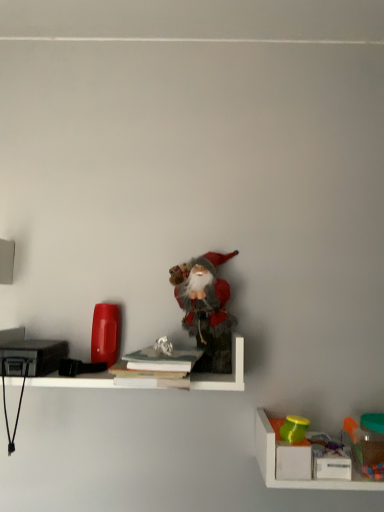
Question: Is matte green cup at lower right, placed as the second toy when sorted from right to left, oriented away from hardcover book at center, which ranks as the second book in top-to-bottom order?

Choices:
 (A) no
 (B) yes

Answer: (A)

Question: Does matte green cup at lower right, placed as the 2th toy when sorted from bottom to top, have a larger size compared to hardcover book at center, which ranks as the second book in top-to-bottom order?

Choices:
 (A) no
 (B) yes

Answer: (A)

Question: Is matte green cup at lower right, which is the 2th toy in left-to-right order, in front of hardcover book at center, which ranks as the second book in top-to-bottom order?

Choices:
 (A) no
 (B) yes

Answer: (A)

Question: From a real-world perspective, is matte green cup at lower right, placed as the 2th toy when sorted from bottom to top, positioned over hardcover book at center, which ranks as the second book in top-to-bottom order, based on gravity?

Choices:
 (A) no
 (B) yes

Answer: (A)

Question: Is matte green cup at lower right, positioned as the 2th toy in top-to-bottom order, at the left side of hardcover book at center, which ranks as the second book in top-to-bottom order?

Choices:
 (A) yes
 (B) no

Answer: (B)

Question: Is white paper at center, the 1th book positioned from the top, spatially inside translucent plastic container at lower right, the second shelf viewed from the top, or outside of it?

Choices:
 (A) outside
 (B) inside

Answer: (A)

Question: Visually, is white paper at center, the 1th book positioned from the top, positioned to the left or to the right of translucent plastic container at lower right, the 1th shelf when ordered from bottom to top?

Choices:
 (A) left
 (B) right

Answer: (A)

Question: Is white paper at center, which ranks as the second book in bottom-to-top order, taller or shorter than translucent plastic container at lower right, the second shelf viewed from the left?

Choices:
 (A) tall
 (B) short

Answer: (B)

Question: Looking at the image, does white paper at center, the 1th book positioned from the top, seem bigger or smaller compared to translucent plastic container at lower right, the second shelf viewed from the left?

Choices:
 (A) big
 (B) small

Answer: (B)

Question: Considering the positions of white matte shelf at center, the second shelf ordered from the bottom, and translucent plastic container at lower right, positioned as the 3th toy in left-to-right order, in the image, is white matte shelf at center, the second shelf ordered from the bottom, wider or thinner than translucent plastic container at lower right, positioned as the 3th toy in left-to-right order,?

Choices:
 (A) thin
 (B) wide

Answer: (B)

Question: From the image's perspective, is white matte shelf at center, positioned as the first shelf in top-to-bottom order, above or below translucent plastic container at lower right, acting as the first toy starting from the right?

Choices:
 (A) above
 (B) below

Answer: (A)

Question: From a real-world perspective, is white matte shelf at center, which is counted as the 1th shelf, starting from the left, physically located above or below translucent plastic container at lower right, which is the 1th toy in bottom-to-top order?

Choices:
 (A) above
 (B) below

Answer: (A)

Question: Considering the positions of point (188, 376) and point (375, 433), is point (188, 376) closer or farther from the camera than point (375, 433)?

Choices:
 (A) closer
 (B) farther

Answer: (A)

Question: Does point (291, 428) appear closer or farther from the camera than point (372, 444)?

Choices:
 (A) closer
 (B) farther

Answer: (B)

Question: Considering the positions of matte green cup at lower right, placed as the second toy when sorted from right to left, and translucent plastic container at lower right, positioned as the 3th toy in left-to-right order, in the image, is matte green cup at lower right, placed as the second toy when sorted from right to left, wider or thinner than translucent plastic container at lower right, positioned as the 3th toy in left-to-right order,?

Choices:
 (A) wide
 (B) thin

Answer: (B)